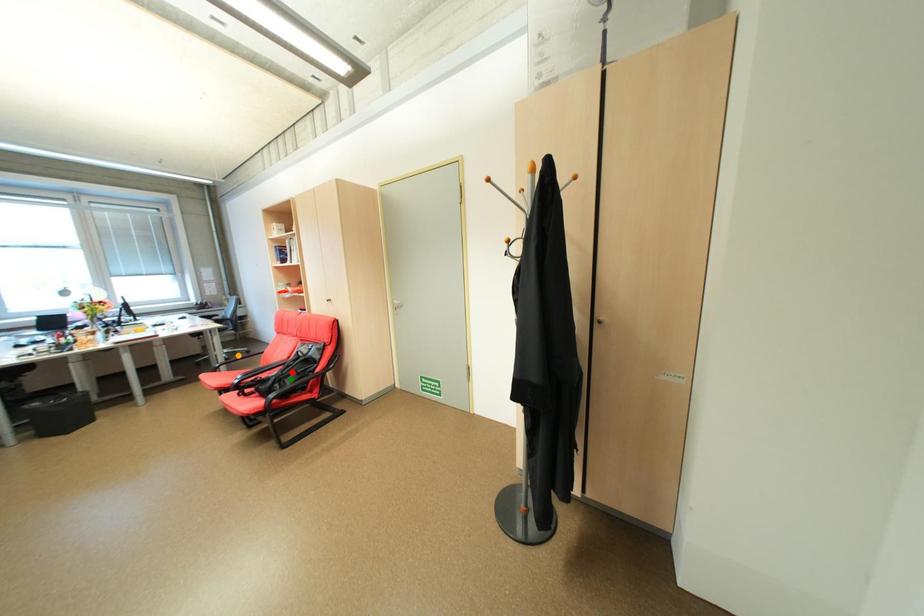
Order these from farthest to nearest:
1. red point
2. green point
3. orange point

1. orange point
2. red point
3. green point